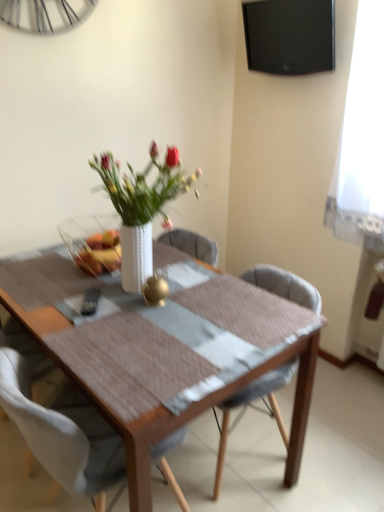
Question: Should I look upward or downward to see translucent glass bowl at center?

Choices:
 (A) down
 (B) up

Answer: (B)

Question: Considering the relative sizes of white fabric chair at center, arranged as the second chair when viewed from the right, and black glossy tv at upper right in the image provided, is white fabric chair at center, arranged as the second chair when viewed from the right, bigger than black glossy tv at upper right?

Choices:
 (A) yes
 (B) no

Answer: (A)

Question: From a real-world perspective, is white fabric chair at center, marked as the first chair in a left-to-right arrangement, on black glossy tv at upper right?

Choices:
 (A) no
 (B) yes

Answer: (A)

Question: Are white fabric chair at center, arranged as the second chair when viewed from the right, and black glossy tv at upper right beside each other?

Choices:
 (A) yes
 (B) no

Answer: (B)

Question: Is white fabric chair at center, arranged as the second chair when viewed from the right, facing away from black glossy tv at upper right?

Choices:
 (A) no
 (B) yes

Answer: (A)

Question: From a real-world perspective, is white fabric chair at center, marked as the first chair in a left-to-right arrangement, physically below black glossy tv at upper right?

Choices:
 (A) yes
 (B) no

Answer: (A)

Question: Does white fabric chair at center, marked as the first chair in a left-to-right arrangement, come behind black glossy tv at upper right?

Choices:
 (A) no
 (B) yes

Answer: (A)

Question: Is wooden table at center positioned beyond the bounds of light gray fabric chair at center, the 1th chair in the right-to-left sequence?

Choices:
 (A) yes
 (B) no

Answer: (A)

Question: From the image's perspective, does wooden table at center appear higher than light gray fabric chair at center, the 1th chair in the right-to-left sequence?

Choices:
 (A) yes
 (B) no

Answer: (A)

Question: Is wooden table at center at the right side of light gray fabric chair at center, the 2th chair from the left?

Choices:
 (A) no
 (B) yes

Answer: (A)

Question: Is wooden table at center positioned with its back to light gray fabric chair at center, the 2th chair from the left?

Choices:
 (A) no
 (B) yes

Answer: (A)

Question: From the image's perspective, would you say wooden table at center is shown under light gray fabric chair at center, the 2th chair from the left?

Choices:
 (A) no
 (B) yes

Answer: (A)

Question: Is wooden table at center closer to the viewer compared to light gray fabric chair at center, the 1th chair in the right-to-left sequence?

Choices:
 (A) yes
 (B) no

Answer: (A)

Question: Is light gray fabric chair at center, the 1th chair in the right-to-left sequence, thinner than white fabric chair at center, marked as the first chair in a left-to-right arrangement?

Choices:
 (A) no
 (B) yes

Answer: (A)